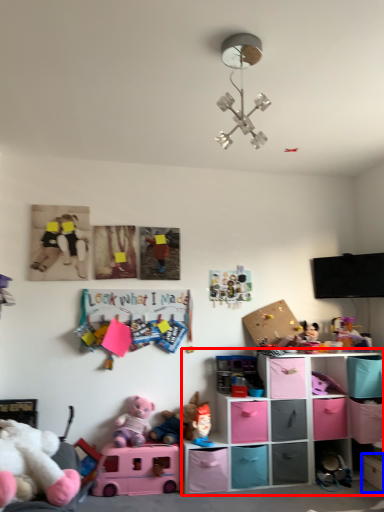
Question: Which point is closer to the camera, shelf (highlighted by a red box) or shelf (highlighted by a blue box)?

Choices:
 (A) shelf
 (B) shelf

Answer: (B)